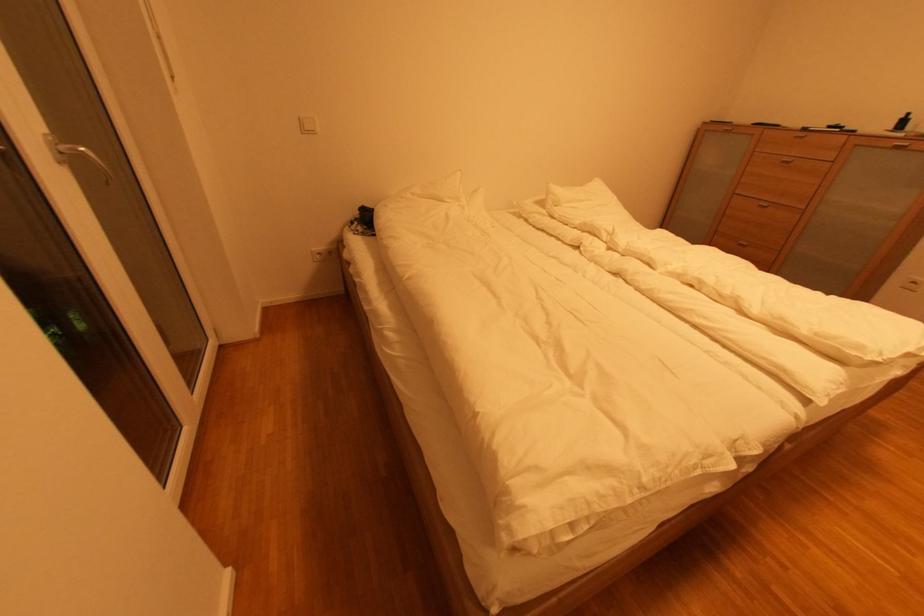
Find the location of `small black bottle`. small black bottle is located at coordinates (902, 122).